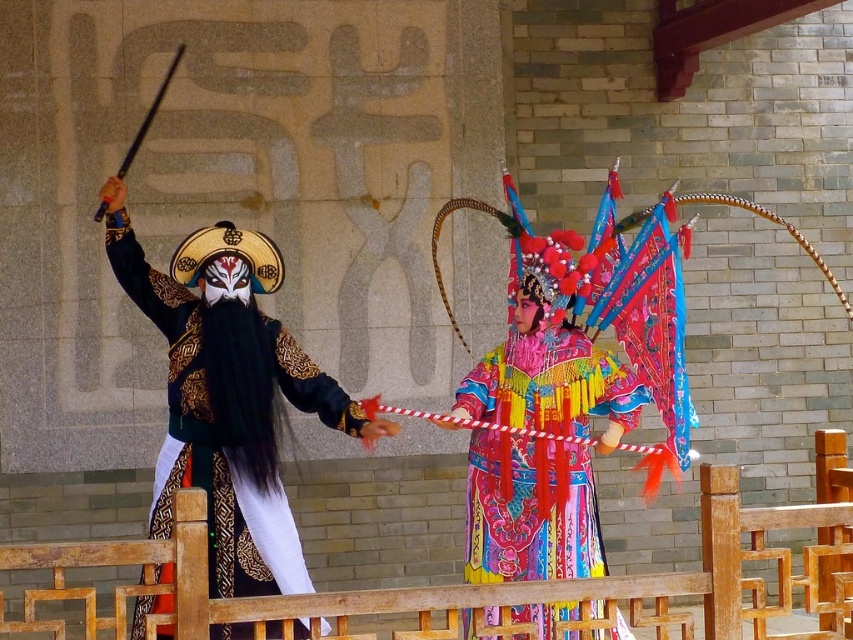
Question: Which point is closer to the camera?

Choices:
 (A) vibrant silk robe at center
 (B) black satin mask at left

Answer: (B)

Question: Does black satin mask at left have a larger size compared to vibrant silk robe at center?

Choices:
 (A) no
 (B) yes

Answer: (B)

Question: Which point appears closest to the camera in this image?

Choices:
 (A) (543, 461)
 (B) (172, 392)

Answer: (B)

Question: Which of the following is the closest to the observer?

Choices:
 (A) (589, 384)
 (B) (262, 404)

Answer: (B)

Question: In this image, where is black satin mask at left located relative to vibrant silk robe at center?

Choices:
 (A) left
 (B) right

Answer: (A)

Question: Considering the relative positions of black satin mask at left and vibrant silk robe at center in the image provided, where is black satin mask at left located with respect to vibrant silk robe at center?

Choices:
 (A) right
 (B) left

Answer: (B)